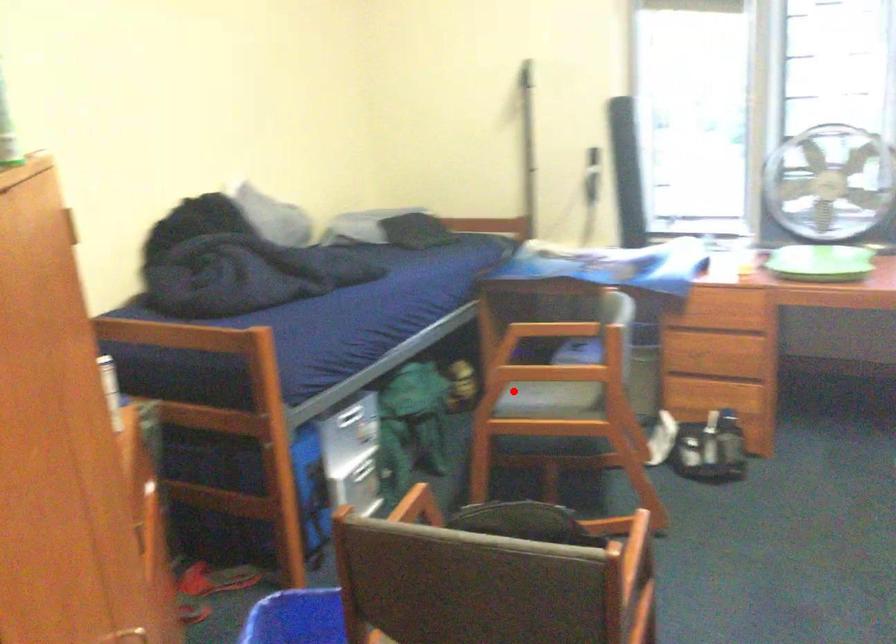
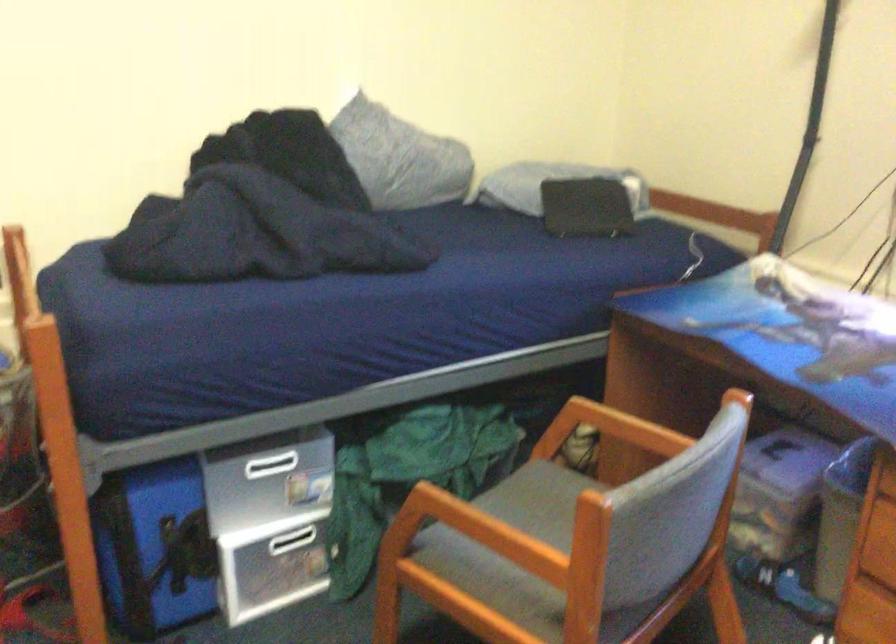
In the second image, find the point that corresponds to the highlighted location in the first image.

(519, 518)